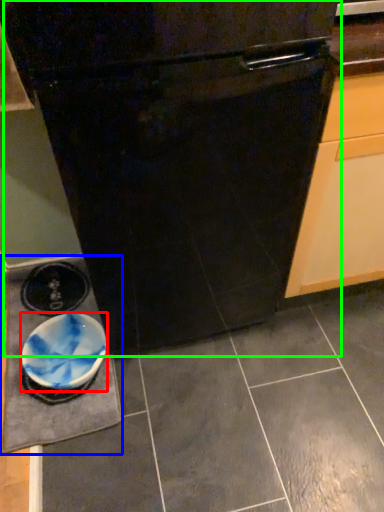
Question: Which object is positioned farthest from bowl (highlighted by a red box)? Select from slate (highlighted by a blue box) and oven (highlighted by a green box).

Choices:
 (A) slate
 (B) oven

Answer: (B)